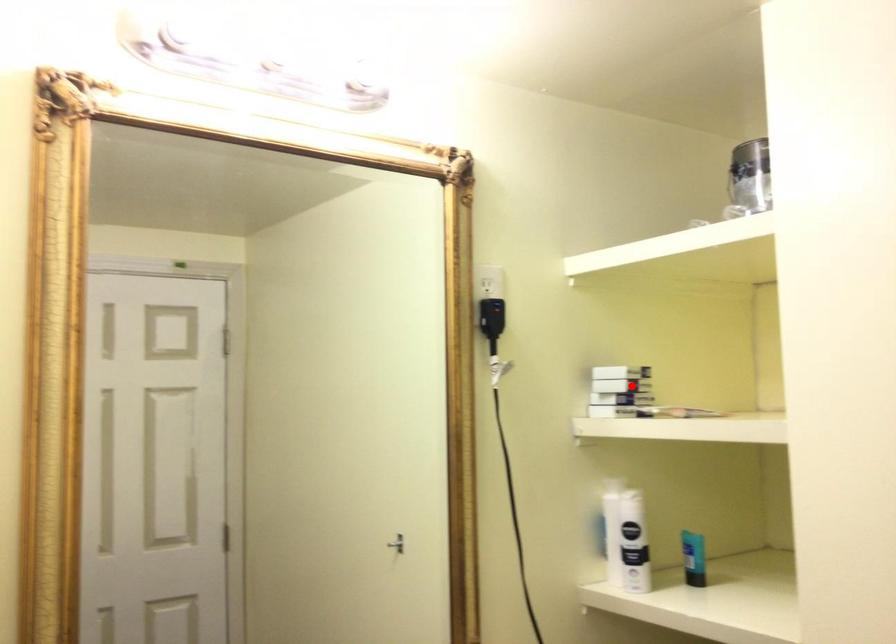
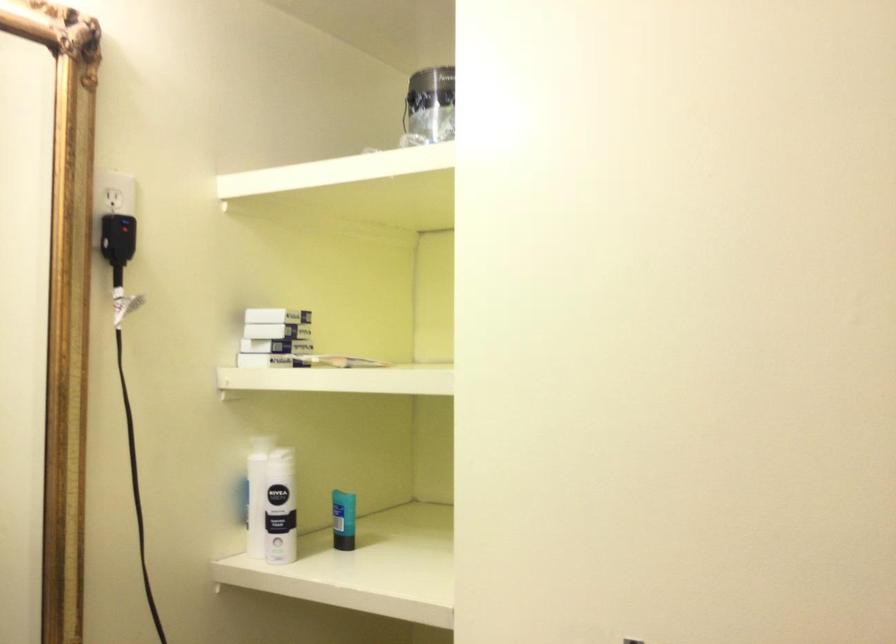
Question: I am providing you with two images of the same scene from different viewpoints. A red point is shown in image1. For the corresponding object point in image2, is it positioned nearer or farther from the camera?

Choices:
 (A) Nearer
 (B) Farther

Answer: (A)